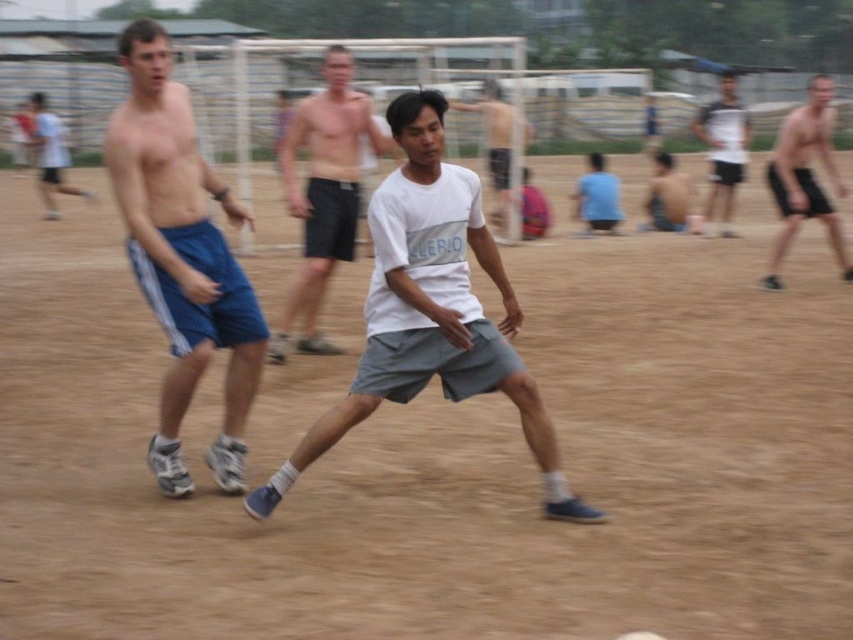
Is white matte shirt at center further to camera compared to matte black shorts at right?

No, it is in front of matte black shorts at right.

In the scene shown: Measure the distance between white matte shirt at center and camera.

They are 8.45 meters apart.

Find the location of a particular element. The image size is (853, 640). white matte shirt at center is located at coordinates (323, 193).

Is matte black shorts at right closer to the viewer compared to smooth skin torso at center?

Yes, matte black shorts at right is closer to the viewer.

Is matte black shorts at right thinner than smooth skin torso at center?

In fact, matte black shorts at right might be wider than smooth skin torso at center.

This screenshot has height=640, width=853. Describe the element at coordinates (805, 179) in the screenshot. I see `matte black shorts at right` at that location.

Identify the location of matte black shorts at right. (805, 179).

Can you confirm if white cotton t-shirt at center is positioned above blue athletic shorts at left?

Actually, white cotton t-shirt at center is below blue athletic shorts at left.

Who is positioned more to the left, white cotton t-shirt at center or blue athletic shorts at left?

Positioned to the left is blue athletic shorts at left.

Where is `white cotton t-shirt at center`? This screenshot has width=853, height=640. white cotton t-shirt at center is located at coordinates click(x=431, y=310).